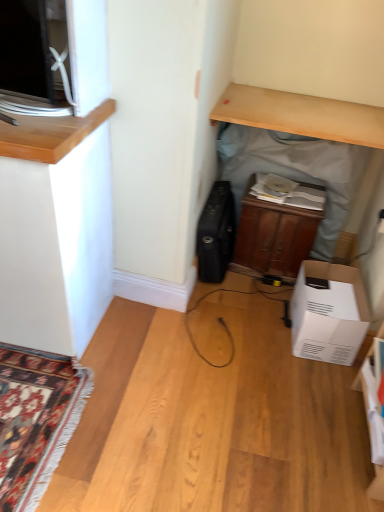
Image resolution: width=384 pixels, height=512 pixels. I want to click on free space in front of black matte suitcase at center, so click(230, 302).